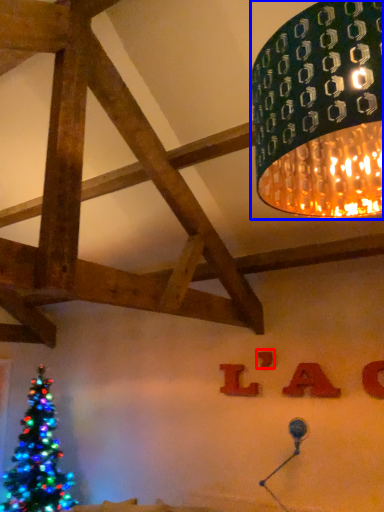
Question: Which object appears closest to the camera in this image, letter (highlighted by a red box) or lamp (highlighted by a blue box)?

Choices:
 (A) letter
 (B) lamp

Answer: (B)